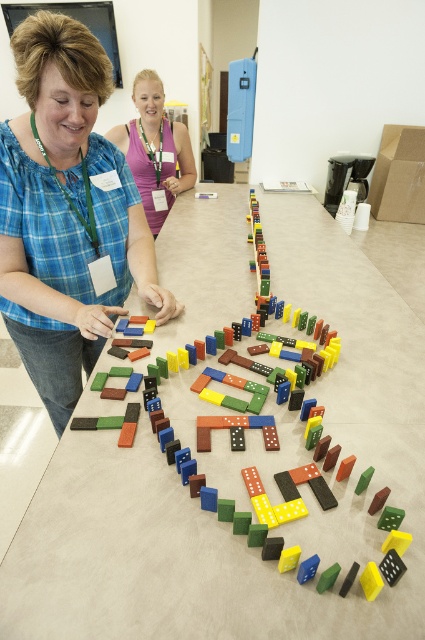
Question: Can you confirm if wooden dominoes at center is thinner than matte purple tank top at upper center?

Choices:
 (A) yes
 (B) no

Answer: (B)

Question: Is matte blue shirt at center below matte purple tank top at upper center?

Choices:
 (A) yes
 (B) no

Answer: (A)

Question: Which of the following is the closest to the observer?

Choices:
 (A) (181, 173)
 (B) (25, 35)

Answer: (B)

Question: Among these objects, which one is farthest from the camera?

Choices:
 (A) wooden dominoes at center
 (B) matte blue shirt at center
 (C) matte purple tank top at upper center

Answer: (C)

Question: Which is nearer to the matte blue shirt at center?

Choices:
 (A) matte purple tank top at upper center
 (B) wooden dominoes at center

Answer: (B)

Question: Is wooden dominoes at center below matte blue shirt at center?

Choices:
 (A) no
 (B) yes

Answer: (A)